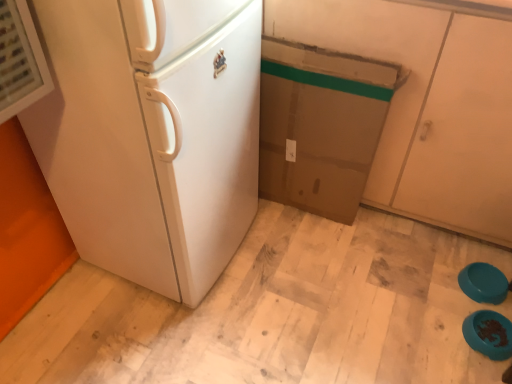
Question: Is teal plastic bowls at lower right, which appears as the 1th appliance when viewed from the back, far away from teal glossy bowls at lower right, marked as the 1th appliance in a front-to-back arrangement?

Choices:
 (A) no
 (B) yes

Answer: (A)

Question: Can you confirm if teal plastic bowls at lower right, the 2th appliance viewed from the front, is positioned to the left of teal glossy bowls at lower right, marked as the 1th appliance in a front-to-back arrangement?

Choices:
 (A) no
 (B) yes

Answer: (A)

Question: From the image's perspective, does teal plastic bowls at lower right, which appears as the 1th appliance when viewed from the back, appear higher than teal glossy bowls at lower right, the 2th appliance in the back-to-front sequence?

Choices:
 (A) no
 (B) yes

Answer: (B)

Question: Is teal plastic bowls at lower right, the 2th appliance viewed from the front, directly adjacent to teal glossy bowls at lower right, marked as the 1th appliance in a front-to-back arrangement?

Choices:
 (A) yes
 (B) no

Answer: (B)

Question: Can you confirm if teal plastic bowls at lower right, the 2th appliance viewed from the front, is shorter than teal glossy bowls at lower right, the 2th appliance in the back-to-front sequence?

Choices:
 (A) no
 (B) yes

Answer: (B)

Question: Is teal plastic bowls at lower right, the 2th appliance viewed from the front, smaller than teal glossy bowls at lower right, marked as the 1th appliance in a front-to-back arrangement?

Choices:
 (A) yes
 (B) no

Answer: (A)

Question: Can you confirm if teal glossy bowls at lower right, the 2th appliance in the back-to-front sequence, is positioned to the right of matte brown cabinet at center?

Choices:
 (A) yes
 (B) no

Answer: (A)

Question: Does teal glossy bowls at lower right, the 2th appliance in the back-to-front sequence, have a greater width compared to matte brown cabinet at center?

Choices:
 (A) no
 (B) yes

Answer: (A)

Question: Considering the relative sizes of teal glossy bowls at lower right, marked as the 1th appliance in a front-to-back arrangement, and matte brown cabinet at center in the image provided, is teal glossy bowls at lower right, marked as the 1th appliance in a front-to-back arrangement, thinner than matte brown cabinet at center?

Choices:
 (A) yes
 (B) no

Answer: (A)

Question: Is teal glossy bowls at lower right, the 2th appliance in the back-to-front sequence, positioned beyond the bounds of matte brown cabinet at center?

Choices:
 (A) no
 (B) yes

Answer: (B)

Question: Can you confirm if teal glossy bowls at lower right, the 2th appliance in the back-to-front sequence, is shorter than matte brown cabinet at center?

Choices:
 (A) no
 (B) yes

Answer: (B)

Question: Does matte brown cabinet at center appear on the right side of teal glossy bowls at lower right, marked as the 1th appliance in a front-to-back arrangement?

Choices:
 (A) yes
 (B) no

Answer: (B)